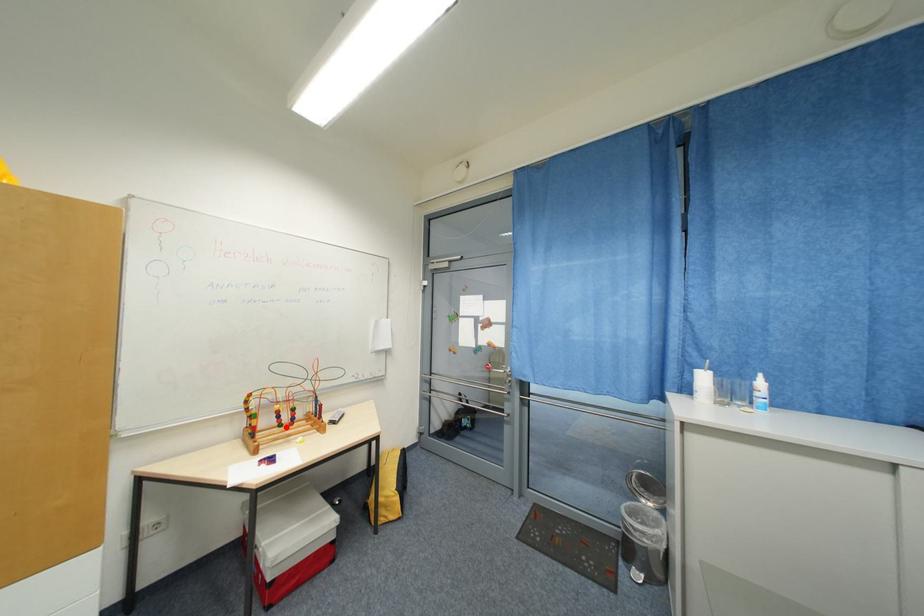
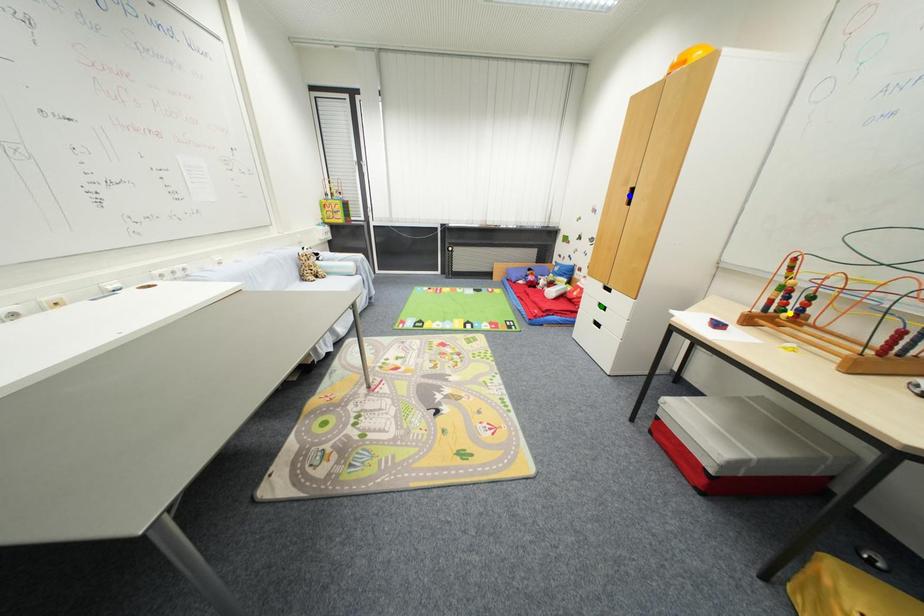
Question: I am providing you with two images of the same scene from different viewpoints. A red point is marked on the first image. You are given multiple points on the second image. Can you choose the point in image 2 that corresponds to the point in image 1?

Choices:
 (A) green point
 (B) blue point
 (C) yellow point

Answer: (C)